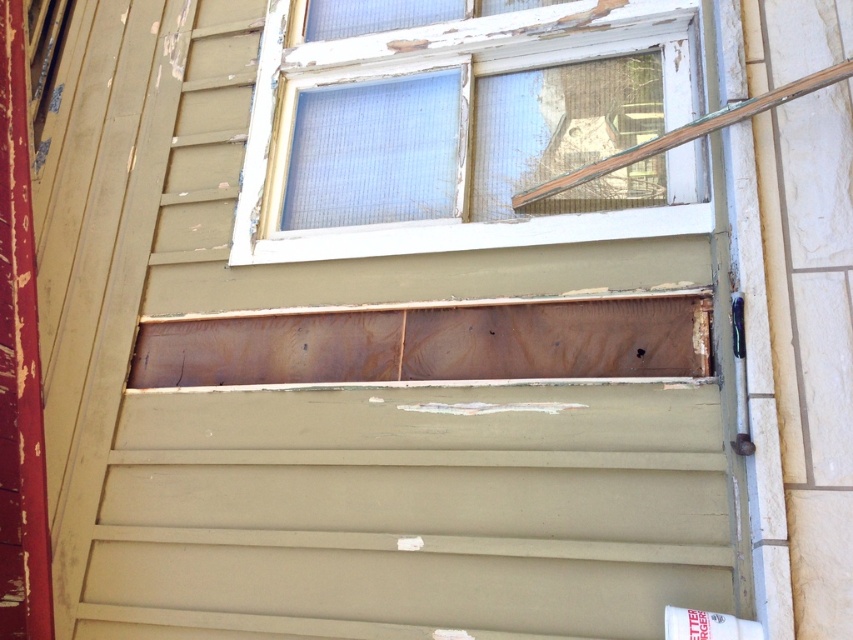
Is white wood window frame at upper center behind wooden panel at center?

Yes, it is.

Identify the location of white wood window frame at upper center. The image size is (853, 640). (466, 131).

Where is `white wood window frame at upper center`? white wood window frame at upper center is located at coordinates (x=466, y=131).

Does point (436, 113) come closer to viewer compared to point (660, 145)?

No.

Which is in front, point (274, 257) or point (692, 124)?

Point (692, 124) is more forward.

What do you see at coordinates (466, 131) in the screenshot?
I see `white wood window frame at upper center` at bounding box center [466, 131].

Where is `white wood window frame at upper center`? This screenshot has height=640, width=853. white wood window frame at upper center is located at coordinates (466, 131).

Is wooden panel at center shorter than wooden at upper right?

Correct, wooden panel at center is not as tall as wooden at upper right.

Is wooden panel at center positioned in front of wooden at upper right?

That is False.

Is point (234, 340) farther from camera compared to point (787, 93)?

Yes, it is.

At what (x,y) coordinates should I click in order to perform the action: click on wooden panel at center. Please return your answer as a coordinate pair (x, y). The height and width of the screenshot is (640, 853). Looking at the image, I should click on (431, 342).